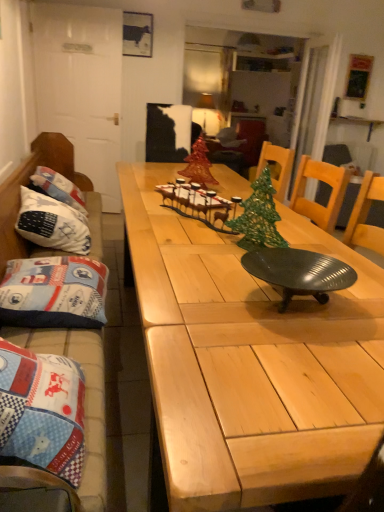
Where is `vacant location below metallic dark green tray at center (from a real-world perspective)`? Image resolution: width=384 pixels, height=512 pixels. vacant location below metallic dark green tray at center (from a real-world perspective) is located at coordinates (286, 305).